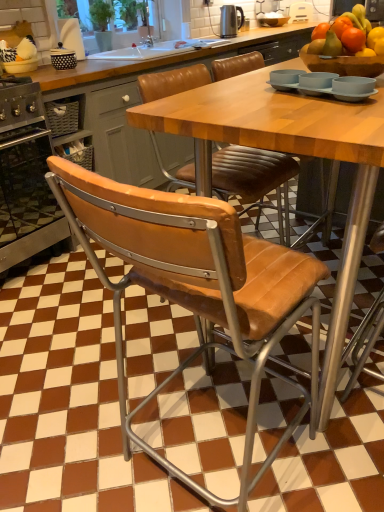
Question: From the image's perspective, would you say stainless steel oven at left is shown under leather-like tan chair at center?

Choices:
 (A) yes
 (B) no

Answer: (B)

Question: Would you say stainless steel oven at left contains leather-like tan chair at center?

Choices:
 (A) yes
 (B) no

Answer: (B)

Question: From a real-world perspective, is stainless steel oven at left positioned under leather-like tan chair at center based on gravity?

Choices:
 (A) no
 (B) yes

Answer: (A)

Question: Is stainless steel oven at left positioned with its back to leather-like tan chair at center?

Choices:
 (A) yes
 (B) no

Answer: (B)

Question: From the image's perspective, is stainless steel oven at left located above leather-like tan chair at center?

Choices:
 (A) no
 (B) yes

Answer: (B)

Question: Considering the positions of point (18, 224) and point (230, 10), is point (18, 224) closer or farther from the camera than point (230, 10)?

Choices:
 (A) farther
 (B) closer

Answer: (B)

Question: Choose the correct answer: Is stainless steel oven at left inside polished stainless steel kettle at upper center, positioned as the first appliance in bottom-to-top order, or outside it?

Choices:
 (A) outside
 (B) inside

Answer: (A)

Question: From a real-world perspective, is stainless steel oven at left positioned above or below polished stainless steel kettle at upper center, the first appliance positioned from the left?

Choices:
 (A) below
 (B) above

Answer: (A)

Question: From the image's perspective, is stainless steel oven at left located above or below polished stainless steel kettle at upper center, the first appliance positioned from the left?

Choices:
 (A) below
 (B) above

Answer: (A)

Question: From the image's perspective, is polished stainless steel kettle at upper center, marked as the 1th appliance in a front-to-back arrangement, located above or below leather-like tan chair at center?

Choices:
 (A) below
 (B) above

Answer: (B)

Question: Choose the correct answer: Is polished stainless steel kettle at upper center, marked as the 1th appliance in a front-to-back arrangement, inside leather-like tan chair at center or outside it?

Choices:
 (A) inside
 (B) outside

Answer: (B)

Question: Visually, is polished stainless steel kettle at upper center, the second appliance positioned from the back, positioned to the left or to the right of leather-like tan chair at center?

Choices:
 (A) right
 (B) left

Answer: (A)

Question: From a real-world perspective, is polished stainless steel kettle at upper center, arranged as the 2th appliance when viewed from the right, above or below leather-like tan chair at center?

Choices:
 (A) below
 (B) above

Answer: (B)

Question: From a real-world perspective, is white plastic toaster at upper center, the 2th appliance in the bottom-to-top sequence, physically located above or below polished stainless steel kettle at upper center, positioned as the first appliance in bottom-to-top order?

Choices:
 (A) below
 (B) above

Answer: (A)

Question: From the image's perspective, relative to polished stainless steel kettle at upper center, arranged as the 2th appliance when viewed from the right, is white plastic toaster at upper center, the 2th appliance from the left, above or below?

Choices:
 (A) above
 (B) below

Answer: (A)